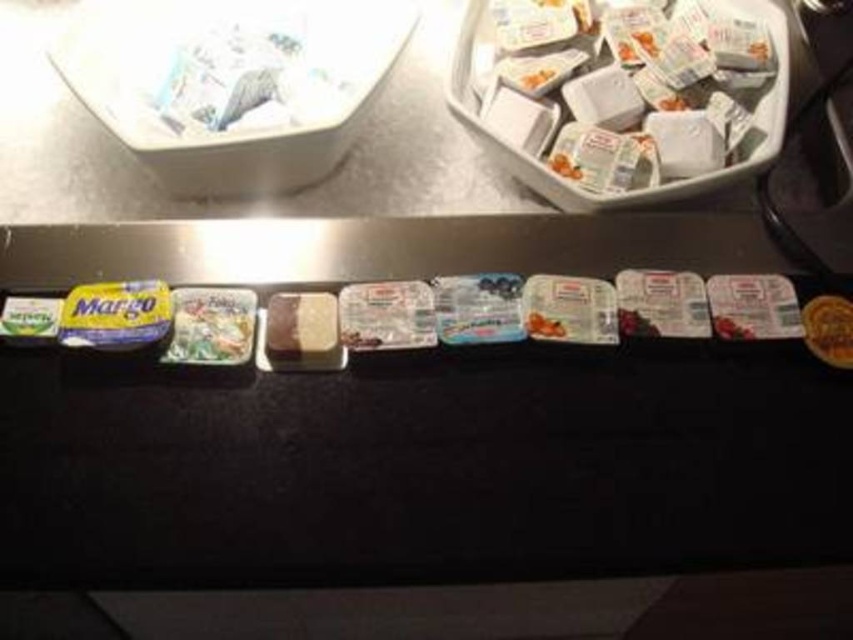
You are a customer at a deli counter. You see containers arranged on the counter. The containers at the upper right have a point at coordinate (685, 65). Where is this point located relative to the containers at the upper right?

The point at coordinate (685, 65) is located at the upper right of the containers at the upper right.

You are a customer at a deli counter. You see the white plastic containers at upper right and the white paper bag at upper left. Which one is positioned more to the right side of the counter?

The white plastic containers at upper right are positioned more to the right side of the counter than the white paper bag at upper left.

You are a customer at a deli counter and see the white plastic containers at upper right and the white paper bag at upper left. Which item is closer to the edge of the countertop?

The white paper bag at upper left is closer to the edge of the countertop because it is positioned above the white plastic containers at upper right, which are underneath it.